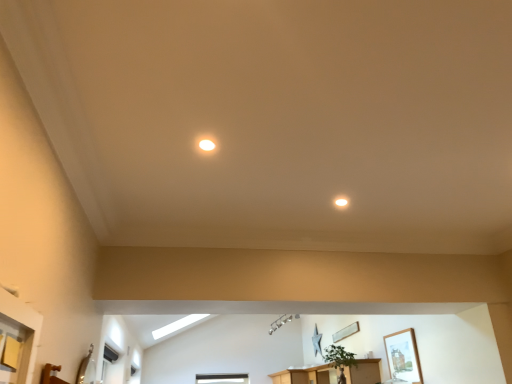
Locate an element on the screen. matte white light fixture at upper center, which appears as the 1th lighting when viewed from the top is located at coordinates [206, 145].

How much space does matte white light fixture at upper center, positioned as the first lighting in back-to-front order, occupy horizontally?

It is 3.65 inches.

What do you see at coordinates (341, 202) in the screenshot? I see `matte white light fixture at upper center, acting as the second lighting starting from the left` at bounding box center [341, 202].

Identify the location of green matte plant at center. Image resolution: width=512 pixels, height=384 pixels. (339, 356).

Where is `wooden cabinet at lower center`? This screenshot has width=512, height=384. wooden cabinet at lower center is located at coordinates (304, 375).

Would you say green matte plant at center is outside matte white light fixture at upper center, which appears as the 1th lighting when viewed from the top?

Yes, green matte plant at center is located beyond the bounds of matte white light fixture at upper center, which appears as the 1th lighting when viewed from the top.

Between green matte plant at center and matte white light fixture at upper center, the 2th lighting positioned from the right, which one has more height?

green matte plant at center.

Is green matte plant at center thinner than matte white light fixture at upper center, placed as the 1th lighting when sorted from left to right?

No.

Is green matte plant at center oriented away from matte white light fixture at upper center, the second lighting in the back-to-front sequence?

That's not correct — green matte plant at center is not looking away from matte white light fixture at upper center, the second lighting in the back-to-front sequence.

This screenshot has height=384, width=512. I want to click on picture frame that is the 2nd one when counting upward from the wooden cabinet at lower center (from the image's perspective), so click(x=403, y=356).

From the image's perspective, is wooden cabinet at lower center located beneath wooden framed picture at upper right, placed as the second picture frame when sorted from left to right?

Yes.

Is wooden cabinet at lower center positioned with its back to wooden framed picture at upper right, which ranks as the first picture frame in right-to-left order?

wooden cabinet at lower center is not turned away from wooden framed picture at upper right, which ranks as the first picture frame in right-to-left order.

I want to click on plant above the wooden cabinet at lower center (from a real-world perspective), so click(x=339, y=356).

From a real-world perspective, is wooden cabinet at lower center positioned above or below green matte plant at center?

wooden cabinet at lower center is situated lower than green matte plant at center in the real world.

Is wooden cabinet at lower center positioned with its back to green matte plant at center?

No, green matte plant at center is not at the back of wooden cabinet at lower center.

From the image's perspective, which one is positioned lower, wooden cabinet at lower center or green matte plant at center?

From the image's view, wooden cabinet at lower center is below.

Which of these two, green matte plant at center or wooden cabinet at lower center, is wider?

wooden cabinet at lower center is wider.

Is green matte plant at center spatially inside wooden cabinet at lower center, or outside of it?

green matte plant at center is located beyond the bounds of wooden cabinet at lower center.

From the image's perspective, is green matte plant at center located above or below wooden cabinet at lower center?

green matte plant at center is above wooden cabinet at lower center.

Between green matte plant at center and wooden cabinet at lower center, which one appears on the left side from the viewer's perspective?

green matte plant at center.

Based on the photo, between green matte plant at center and wooden picture frame at center, which is the 2th picture frame from right to left, which one is positioned behind?

wooden picture frame at center, which is the 2th picture frame from right to left.

Does point (326, 356) come in front of point (343, 336)?

That is True.

From the image's perspective, is green matte plant at center positioned above or below wooden picture frame at center, placed as the 1th picture frame when sorted from left to right?

green matte plant at center is situated higher than wooden picture frame at center, placed as the 1th picture frame when sorted from left to right, in the image.

Is wooden framed picture at upper right, the 2th picture frame in the back-to-front sequence, not within wooden picture frame at center, placed as the 1th picture frame when sorted from left to right?

Absolutely, wooden framed picture at upper right, the 2th picture frame in the back-to-front sequence, is external to wooden picture frame at center, placed as the 1th picture frame when sorted from left to right.

How many degrees apart are the facing directions of wooden framed picture at upper right, which appears as the 1th picture frame when viewed from the front, and wooden picture frame at center, placed as the 1th picture frame when sorted from left to right?

0.498 degrees.

Is wooden framed picture at upper right, which appears as the 1th picture frame when viewed from the front, aimed at wooden picture frame at center, placed as the 1th picture frame when sorted from left to right?

No, wooden framed picture at upper right, which appears as the 1th picture frame when viewed from the front, does not turn towards wooden picture frame at center, placed as the 1th picture frame when sorted from left to right.

Which object is further away from the camera taking this photo, wooden framed picture at upper right, which appears as the 1th picture frame when viewed from the front, or wooden picture frame at center, which is the 2th picture frame from right to left?

wooden picture frame at center, which is the 2th picture frame from right to left, is further from the camera.

Is wooden cabinet at lower center taller than matte white light fixture at upper center, which is the 1th lighting from front to back?

Yes.

Locate an element on the screen. This screenshot has height=384, width=512. furniture that appears on the right of matte white light fixture at upper center, placed as the 1th lighting when sorted from left to right is located at coordinates (304, 375).

Is matte white light fixture at upper center, the 2th lighting positioned from the right, a part of wooden cabinet at lower center?

Definitely not — matte white light fixture at upper center, the 2th lighting positioned from the right, is not inside wooden cabinet at lower center.

Identify the location of plant below the matte white light fixture at upper center, positioned as the second lighting in bottom-to-top order (from a real-world perspective). click(x=339, y=356).

Where is `furniture below the wooden framed picture at upper right, which ranks as the first picture frame in right-to-left order (from the image's perspective)`? The image size is (512, 384). furniture below the wooden framed picture at upper right, which ranks as the first picture frame in right-to-left order (from the image's perspective) is located at coordinates (304, 375).

Looking at the image, which one is located closer to green matte plant at center, wooden cabinet at lower center or matte white light fixture at upper center, which appears as the 1th lighting when viewed from the top?

wooden cabinet at lower center lies closer to green matte plant at center than the other object.

Which object lies nearer to the anchor point wooden framed picture at upper right, placed as the second picture frame when sorted from left to right, wooden picture frame at center, arranged as the 1th picture frame when viewed from the back, or green matte plant at center?

Based on the image, green matte plant at center appears to be nearer to wooden framed picture at upper right, placed as the second picture frame when sorted from left to right.

From the image, which object appears to be nearer to wooden framed picture at upper right, the 2th picture frame in the back-to-front sequence, matte white light fixture at upper center, positioned as the first lighting in back-to-front order, or matte white light fixture at upper center, which is the 1th lighting from front to back?

Based on the image, matte white light fixture at upper center, positioned as the first lighting in back-to-front order, appears to be nearer to wooden framed picture at upper right, the 2th picture frame in the back-to-front sequence.

Looking at the image, which one is located further to wooden framed picture at upper right, the 2th picture frame in the back-to-front sequence, wooden picture frame at center, which is counted as the 2th picture frame, starting from the front, or matte white light fixture at upper center, which appears as the 1th lighting when viewed from the top?

matte white light fixture at upper center, which appears as the 1th lighting when viewed from the top.

Which object lies nearer to the anchor point matte white light fixture at upper center, positioned as the second lighting in bottom-to-top order, green matte plant at center or wooden framed picture at upper right, which appears as the 1th picture frame when viewed from the front?

The object closer to matte white light fixture at upper center, positioned as the second lighting in bottom-to-top order, is wooden framed picture at upper right, which appears as the 1th picture frame when viewed from the front.

Looking at this image, based on their spatial positions, is wooden framed picture at upper right, which ranks as the first picture frame in right-to-left order, or matte white light fixture at upper center, positioned as the second lighting in bottom-to-top order, further from matte white light fixture at upper center, the 1th lighting in the right-to-left sequence?

wooden framed picture at upper right, which ranks as the first picture frame in right-to-left order, is further to matte white light fixture at upper center, the 1th lighting in the right-to-left sequence.

Considering their positions, is matte white light fixture at upper center, positioned as the first lighting in back-to-front order, positioned closer to wooden picture frame at center, placed as the 1th picture frame when sorted from left to right, than matte white light fixture at upper center, which is the 1th lighting from front to back?

matte white light fixture at upper center, positioned as the first lighting in back-to-front order, lies closer to wooden picture frame at center, placed as the 1th picture frame when sorted from left to right, than the other object.

Considering their positions, is matte white light fixture at upper center, the 2th lighting positioned from the right, positioned further to green matte plant at center than wooden framed picture at upper right, the 2th picture frame in the back-to-front sequence?

matte white light fixture at upper center, the 2th lighting positioned from the right, is further to green matte plant at center.

Image resolution: width=512 pixels, height=384 pixels. Find the location of `plant between wooden framed picture at upper right, which appears as the 1th picture frame when viewed from the front, and wooden picture frame at center, arranged as the 1th picture frame when viewed from the back, along the z-axis`. plant between wooden framed picture at upper right, which appears as the 1th picture frame when viewed from the front, and wooden picture frame at center, arranged as the 1th picture frame when viewed from the back, along the z-axis is located at coordinates (339, 356).

Locate an element on the screen. The width and height of the screenshot is (512, 384). furniture positioned between green matte plant at center and wooden picture frame at center, placed as the 1th picture frame when sorted from left to right, from near to far is located at coordinates (304, 375).

You are a GUI agent. You are given a task and a screenshot of the screen. Output one action in this format:
    pyautogui.click(x=<x>, y=<y>)
    Task: Click on the plant between matte white light fixture at upper center, acting as the second lighting starting from the left, and wooden cabinet at lower center, in the vertical direction
    Image resolution: width=512 pixels, height=384 pixels.
    Given the screenshot: What is the action you would take?
    pyautogui.click(x=339, y=356)

This screenshot has height=384, width=512. What are the coordinates of `plant located between matte white light fixture at upper center, positioned as the second lighting in bottom-to-top order, and wooden cabinet at lower center in the depth direction` in the screenshot? It's located at (339, 356).